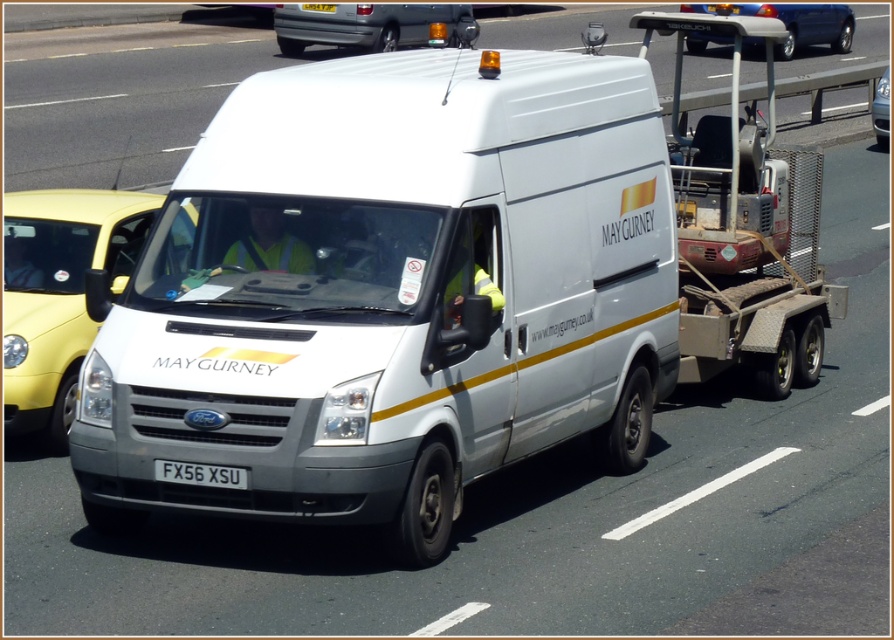
Looking at this image, you are a pedestrian standing at point (58, 292). Which object is exactly at your location?

The white glossy taxi at left is exactly at your location.